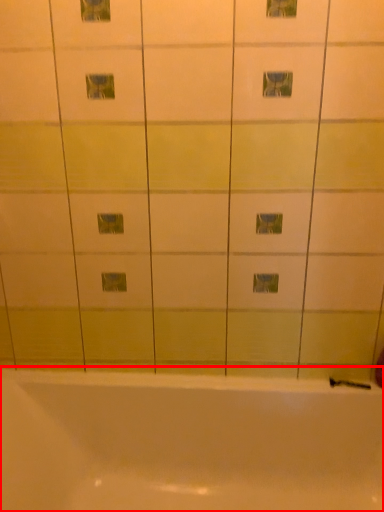
Question: From the image's perspective, what is the correct spatial positioning of bathtub (annotated by the red box) in reference to shower?

Choices:
 (A) below
 (B) above

Answer: (A)